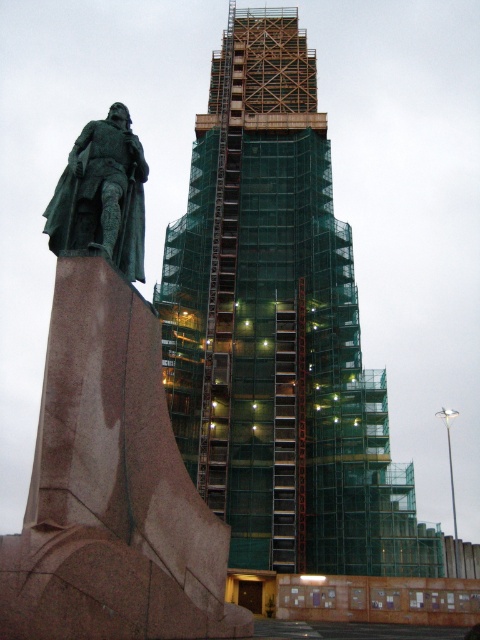
Does green mesh scaffolding at center appear under green patina statue at left?

Incorrect, green mesh scaffolding at center is not positioned below green patina statue at left.

In the scene shown: Does green mesh scaffolding at center have a lesser height compared to green patina statue at left?

No, green mesh scaffolding at center is not shorter than green patina statue at left.

Where is `green mesh scaffolding at center`? green mesh scaffolding at center is located at coordinates (278, 330).

Is green polished stone statue at left positioned at the back of green patina statue at left?

That is False.

Does green polished stone statue at left appear under green patina statue at left?

Correct, green polished stone statue at left is located below green patina statue at left.

Where is `green polished stone statue at left`? This screenshot has height=640, width=480. green polished stone statue at left is located at coordinates (109, 449).

The image size is (480, 640). Find the location of `green polished stone statue at left`. green polished stone statue at left is located at coordinates (109, 449).

Between green mesh scaffolding at center and green polished stone statue at left, which one appears on the right side from the viewer's perspective?

From the viewer's perspective, green mesh scaffolding at center appears more on the right side.

Who is more forward, (259, 244) or (41, 531)?

Point (41, 531)

Is point (340, 516) more distant than point (109, 627)?

That is True.

I want to click on green mesh scaffolding at center, so click(x=278, y=330).